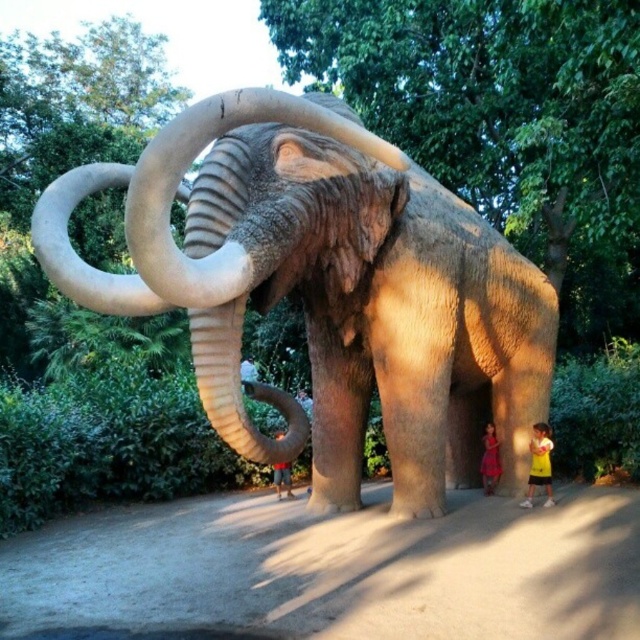
At what (x,y) coordinates should I click in order to perform the action: click on yellow cotton shirt at lower right. Please return your answer as a coordinate pair (x, y). Looking at the image, I should click on point(540,465).

Measure the distance from yellow cotton shirt at lower right to pink fabric dress at lower right.

yellow cotton shirt at lower right and pink fabric dress at lower right are 20.94 inches apart from each other.

Where is `yellow cotton shirt at lower right`? yellow cotton shirt at lower right is located at coordinates (540, 465).

Describe the element at coordinates (282, 477) in the screenshot. I see `light blue jeans at center` at that location.

Does light blue jeans at center have a greater height compared to white fabric shirt at center?

Correct, light blue jeans at center is much taller as white fabric shirt at center.

Between point (282, 474) and point (256, 378), which one is positioned behind?

The point (256, 378) is behind.

Find the location of a particular element. This screenshot has height=640, width=640. light blue jeans at center is located at coordinates (282, 477).

Who is more distant from viewer, (540, 428) or (288, 493)?

The point (288, 493) is more distant.

Can you confirm if yellow cotton shirt at lower right is thinner than light blue jeans at center?

Correct, yellow cotton shirt at lower right's width is less than light blue jeans at center's.

Between point (540, 440) and point (292, 496), which one is positioned in front?

Point (540, 440) is in front.

Image resolution: width=640 pixels, height=640 pixels. I want to click on yellow cotton shirt at lower right, so click(540, 465).